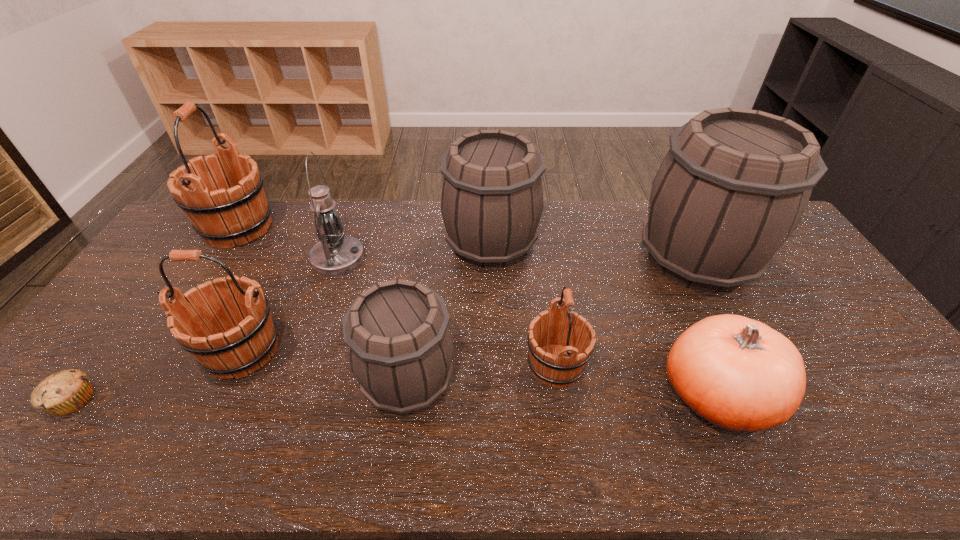
I want to click on the biggest wood wine bucket, so click(237, 212).

Locate an element on the screen. the rightmost wine bucket is located at coordinates (733, 187).

Identify the location of the biggest brown wine bucket. The image size is (960, 540). (733, 187).

Where is `oil lamp`? oil lamp is located at coordinates (336, 254).

You are a GUI agent. You are given a task and a screenshot of the screen. Output one action in this format:
    pyautogui.click(x=<x>, y=<y>)
    Task: Click on the second smallest brown wine bucket
    The width and height of the screenshot is (960, 540).
    Given the screenshot: What is the action you would take?
    pyautogui.click(x=492, y=196)

The image size is (960, 540). I want to click on the second smallest wood wine bucket, so click(233, 337).

The height and width of the screenshot is (540, 960). I want to click on the rightmost wood wine bucket, so click(551, 362).

At what (x,y) coordinates should I click in order to perform the action: click on the smallest brown wine bucket. Please return your answer as a coordinate pair (x, y). The width and height of the screenshot is (960, 540). Looking at the image, I should click on (400, 346).

The image size is (960, 540). What are the coordinates of `pumpkin` in the screenshot? It's located at (739, 374).

Locate an element on the screen. muffin is located at coordinates point(62,393).